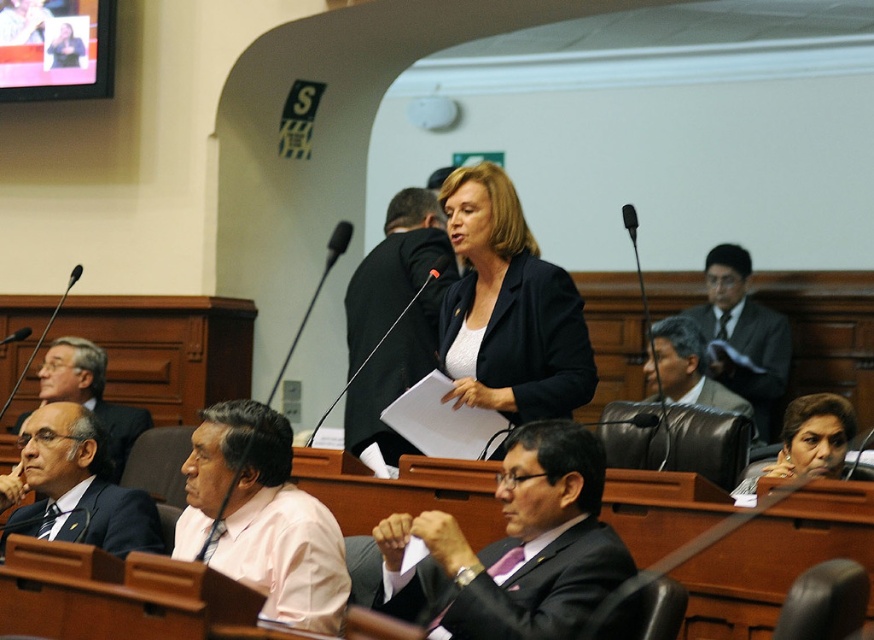
Question: Based on their relative distances, which object is farther from the matte black suit at center?

Choices:
 (A) dark gray suit at center
 (B) dark suit at left
 (C) black matte jacket at center

Answer: (A)

Question: In this image, where is dark gray suit at center located relative to matte black hair at center?

Choices:
 (A) above
 (B) below

Answer: (A)

Question: Is matte black suit at center bigger than matte black hair at center?

Choices:
 (A) no
 (B) yes

Answer: (B)

Question: Which point is farther from the camera taking this photo?

Choices:
 (A) [66, 474]
 (B) [472, 214]
 (C) [392, 365]
 (D) [545, 458]

Answer: (C)

Question: Which of the following is the closest to the observer?

Choices:
 (A) (x=94, y=477)
 (B) (x=545, y=289)
 (C) (x=778, y=452)
 (D) (x=725, y=372)

Answer: (A)

Question: Can you confirm if matte black suit at center is positioned above matte black blazer at center?

Choices:
 (A) yes
 (B) no

Answer: (B)